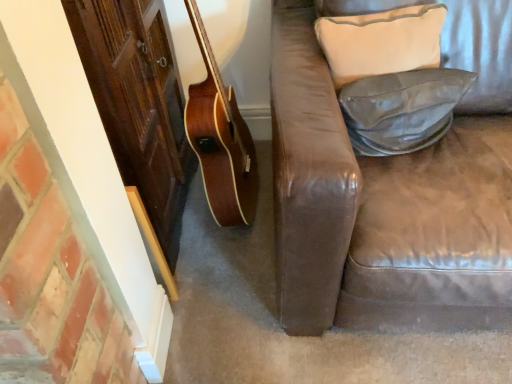
Question: Should I look upward or downward to see beige fabric pillow at upper right, which appears as the 2th pillow when ordered from the bottom?

Choices:
 (A) up
 (B) down

Answer: (A)

Question: Is beige fabric pillow at upper right, which appears as the 2th pillow when ordered from the bottom, aimed at leather-like gray pillow at right, acting as the 1th pillow starting from the bottom?

Choices:
 (A) yes
 (B) no

Answer: (A)

Question: Considering the relative sizes of beige fabric pillow at upper right, arranged as the 1th pillow when viewed from the top, and leather-like gray pillow at right, acting as the 1th pillow starting from the bottom, in the image provided, is beige fabric pillow at upper right, arranged as the 1th pillow when viewed from the top, taller than leather-like gray pillow at right, acting as the 1th pillow starting from the bottom,?

Choices:
 (A) yes
 (B) no

Answer: (A)

Question: From the image's perspective, would you say beige fabric pillow at upper right, arranged as the 1th pillow when viewed from the top, is positioned over leather-like gray pillow at right, acting as the 2th pillow starting from the top?

Choices:
 (A) yes
 (B) no

Answer: (A)

Question: From a real-world perspective, is beige fabric pillow at upper right, which appears as the 2th pillow when ordered from the bottom, located higher than leather-like gray pillow at right, acting as the 2th pillow starting from the top?

Choices:
 (A) no
 (B) yes

Answer: (B)

Question: Is leather-like gray pillow at right, acting as the 1th pillow starting from the bottom, a part of beige fabric pillow at upper right, which appears as the 2th pillow when ordered from the bottom?

Choices:
 (A) yes
 (B) no

Answer: (B)

Question: Considering the relative positions of beige fabric pillow at upper right, which appears as the 2th pillow when ordered from the bottom, and leather-like gray pillow at right, acting as the 1th pillow starting from the bottom, in the image provided, is beige fabric pillow at upper right, which appears as the 2th pillow when ordered from the bottom, in front of leather-like gray pillow at right, acting as the 1th pillow starting from the bottom,?

Choices:
 (A) yes
 (B) no

Answer: (B)

Question: Is leather-like gray pillow at right, acting as the 2th pillow starting from the top, next to beige fabric pillow at upper right, which appears as the 2th pillow when ordered from the bottom, and touching it?

Choices:
 (A) yes
 (B) no

Answer: (B)

Question: From the image's perspective, would you say leather-like gray pillow at right, acting as the 1th pillow starting from the bottom, is positioned over beige fabric pillow at upper right, which appears as the 2th pillow when ordered from the bottom?

Choices:
 (A) yes
 (B) no

Answer: (B)

Question: Can you confirm if leather-like gray pillow at right, acting as the 1th pillow starting from the bottom, is positioned to the left of beige fabric pillow at upper right, arranged as the 1th pillow when viewed from the top?

Choices:
 (A) yes
 (B) no

Answer: (B)

Question: Is leather-like gray pillow at right, acting as the 1th pillow starting from the bottom, positioned before beige fabric pillow at upper right, arranged as the 1th pillow when viewed from the top?

Choices:
 (A) no
 (B) yes

Answer: (B)

Question: Is leather-like gray pillow at right, acting as the 2th pillow starting from the top, at the right side of beige fabric pillow at upper right, arranged as the 1th pillow when viewed from the top?

Choices:
 (A) yes
 (B) no

Answer: (A)

Question: Is leather-like gray pillow at right, acting as the 1th pillow starting from the bottom, thinner than beige fabric pillow at upper right, which appears as the 2th pillow when ordered from the bottom?

Choices:
 (A) no
 (B) yes

Answer: (B)

Question: Is point (379, 18) positioned closer to the camera than point (419, 134)?

Choices:
 (A) farther
 (B) closer

Answer: (B)